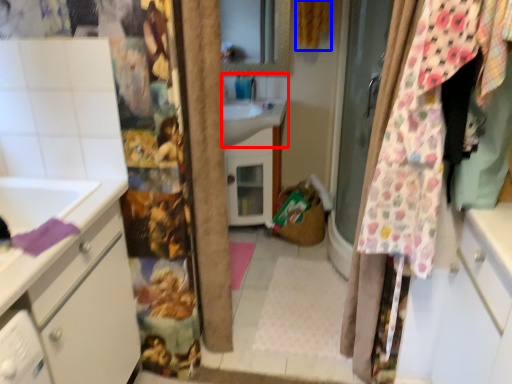
Question: Among these objects, which one is nearest to the camera, sink (highlighted by a red box) or curtain (highlighted by a blue box)?

Choices:
 (A) sink
 (B) curtain

Answer: (B)